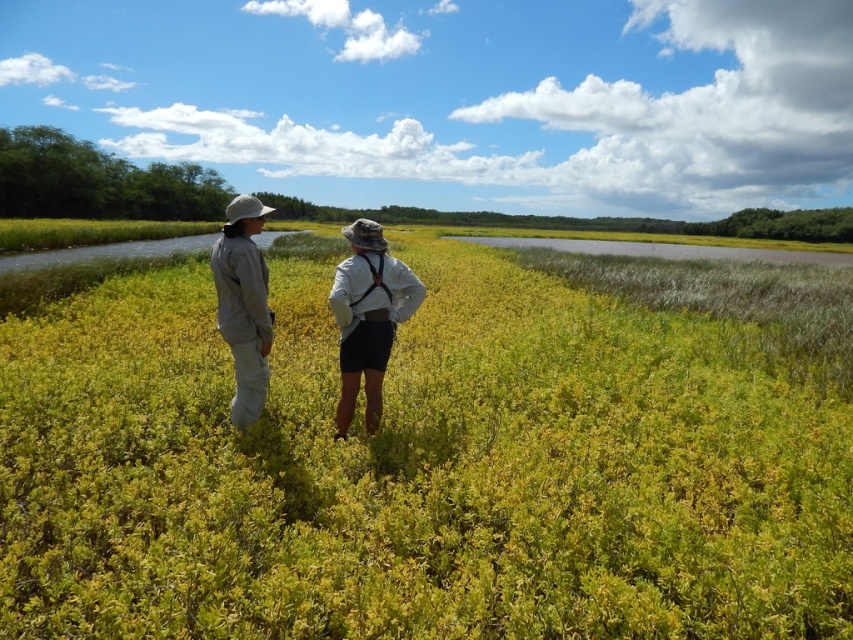
Question: Does khaki fabric pants at center appear over white cotton shirt at center?

Choices:
 (A) no
 (B) yes

Answer: (B)

Question: Which point is farther to the camera?

Choices:
 (A) khaki fabric pants at center
 (B) gray fabric jacket at left
 (C) white cotton shirt at center
 (D) green leafy grass at center

Answer: (C)

Question: Can you confirm if green leafy grass at center is bigger than white cotton shirt at center?

Choices:
 (A) no
 (B) yes

Answer: (B)

Question: Which of the following is the farthest from the observer?

Choices:
 (A) gray fabric jacket at left
 (B) green leafy grass at center
 (C) white cotton shirt at center
 (D) khaki fabric pants at center

Answer: (C)

Question: Which object appears farthest from the camera in this image?

Choices:
 (A) gray fabric jacket at left
 (B) khaki fabric pants at center

Answer: (B)

Question: Can you confirm if white cotton shirt at center is smaller than gray fabric jacket at left?

Choices:
 (A) yes
 (B) no

Answer: (A)